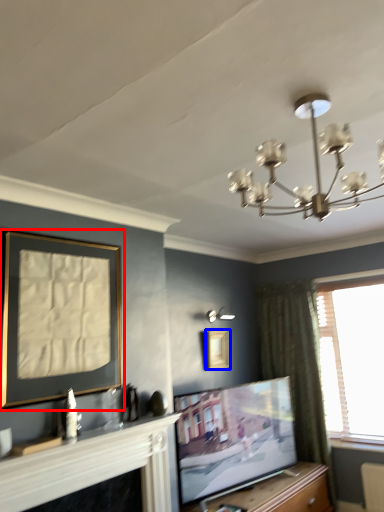
Question: Which object is further to the camera taking this photo, picture frame (highlighted by a red box) or picture frame (highlighted by a blue box)?

Choices:
 (A) picture frame
 (B) picture frame

Answer: (B)